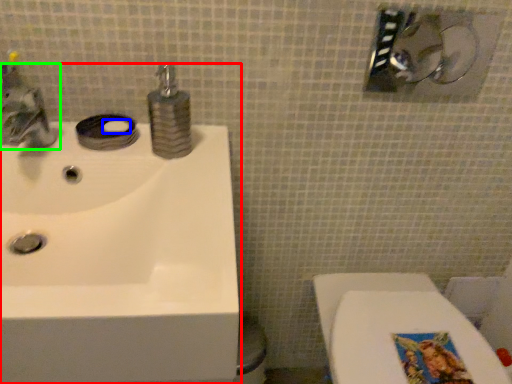
Question: Which is farther away from sink (highlighted by a red box)? soap (highlighted by a blue box) or tap (highlighted by a green box)?

Choices:
 (A) soap
 (B) tap

Answer: (A)